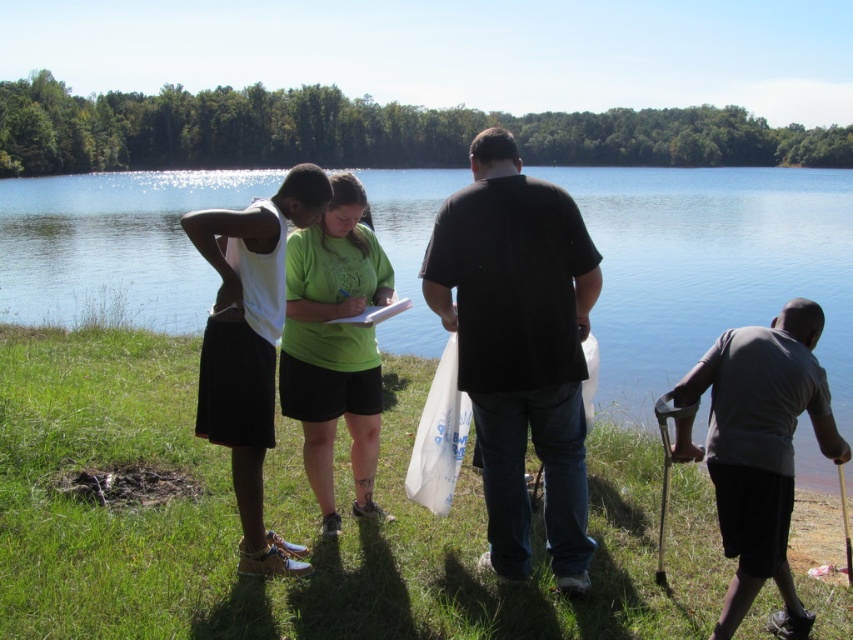
From the picture: You are standing at the camera position and want to find the black matte shirt at center. According to the coordinates provided, where should you look relative to the other people in the scene?

The black matte shirt at center is located at point 0.544 on the horizontal axis and 0.610 on the vertical axis, so you should look towards the center of the image slightly below the midpoint vertically to find it.